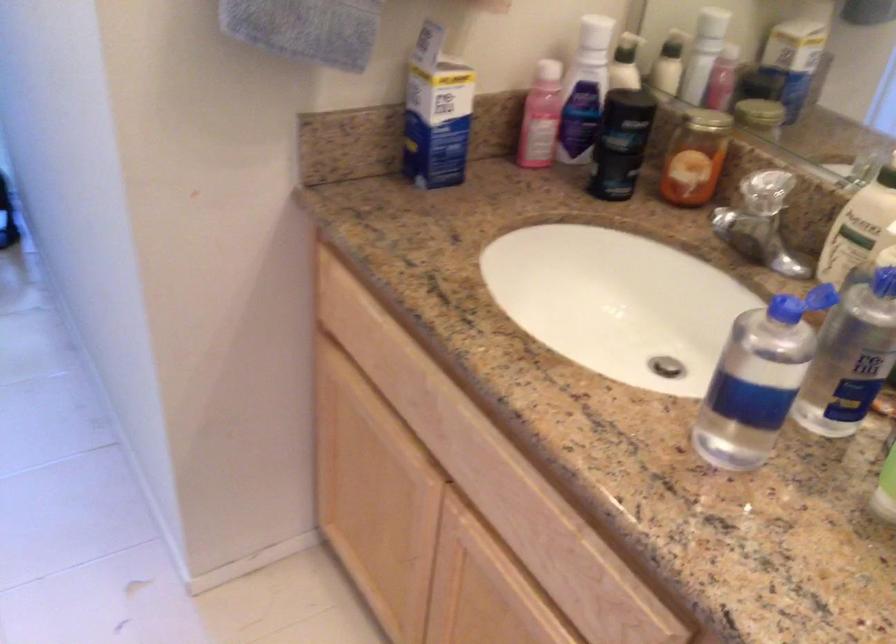
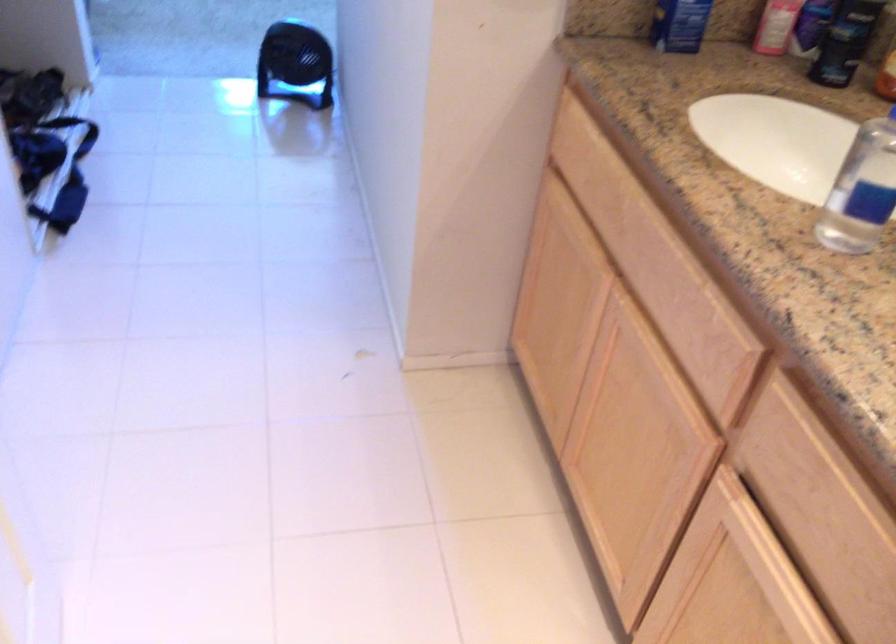
In the second image, find the point that corresponds to (440,154) in the first image.

(679, 24)